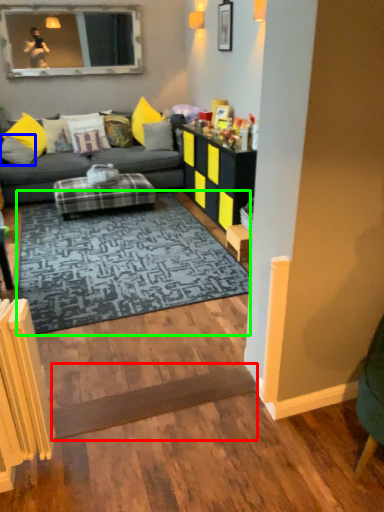
Question: Considering the real-world distances, which object is farthest from plank (highlighted by a red box)? pillow (highlighted by a blue box) or mat (highlighted by a green box)?

Choices:
 (A) pillow
 (B) mat

Answer: (A)